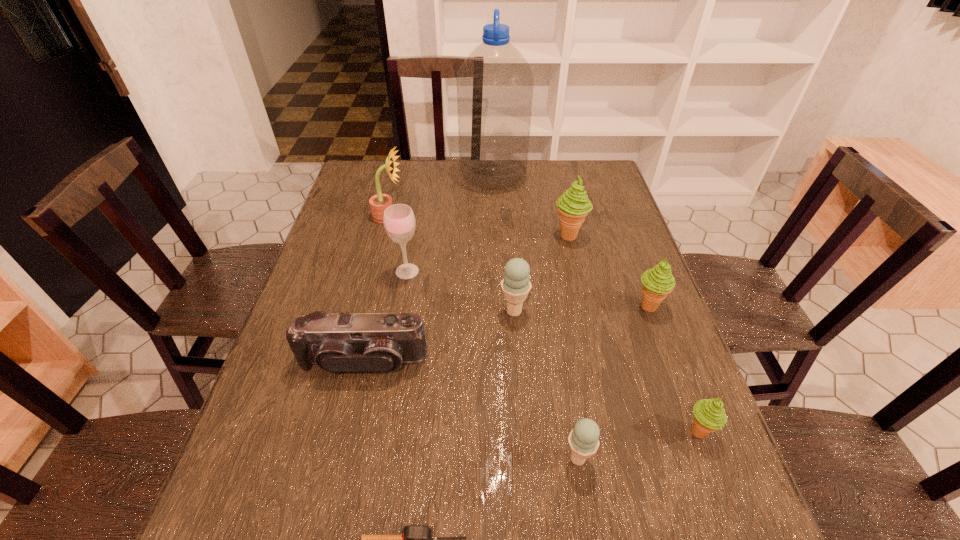
At what (x,y) coordinates should I click in order to perform the action: click on vacant space located on the front-facing side of the camcorder. Please return your answer as a coordinate pair (x, y). The height and width of the screenshot is (540, 960). Looking at the image, I should click on (343, 452).

You are a GUI agent. You are given a task and a screenshot of the screen. Output one action in this format:
    pyautogui.click(x=<x>, y=<y>)
    Task: Click on the vacant space located on the back of the right blue ice cream
    
    Given the screenshot: What is the action you would take?
    pyautogui.click(x=559, y=339)

Find the location of a particular element. Image resolution: width=960 pixels, height=540 pixels. vacant space located 0.250m on the left of the smallest green icecream is located at coordinates (558, 431).

The width and height of the screenshot is (960, 540). Find the location of `object located in the far edge section of the desktop`. object located in the far edge section of the desktop is located at coordinates (495, 83).

Identify the location of sunflower located at the left edge. (378, 203).

This screenshot has height=540, width=960. I want to click on camcorder at the left edge, so click(371, 342).

Find the location of `vacant area at the far edge`. vacant area at the far edge is located at coordinates (468, 188).

Find the location of a particular element. The width and height of the screenshot is (960, 540). vacant space at the left edge of the desktop is located at coordinates coord(279,434).

At what (x,y) coordinates should I click in order to perform the action: click on blank space at the right edge of the desktop. Please return your answer as a coordinate pair (x, y). Image resolution: width=960 pixels, height=540 pixels. Looking at the image, I should click on (592, 253).

Where is `vacant region at the far right corner of the desktop`? vacant region at the far right corner of the desktop is located at coordinates click(592, 160).